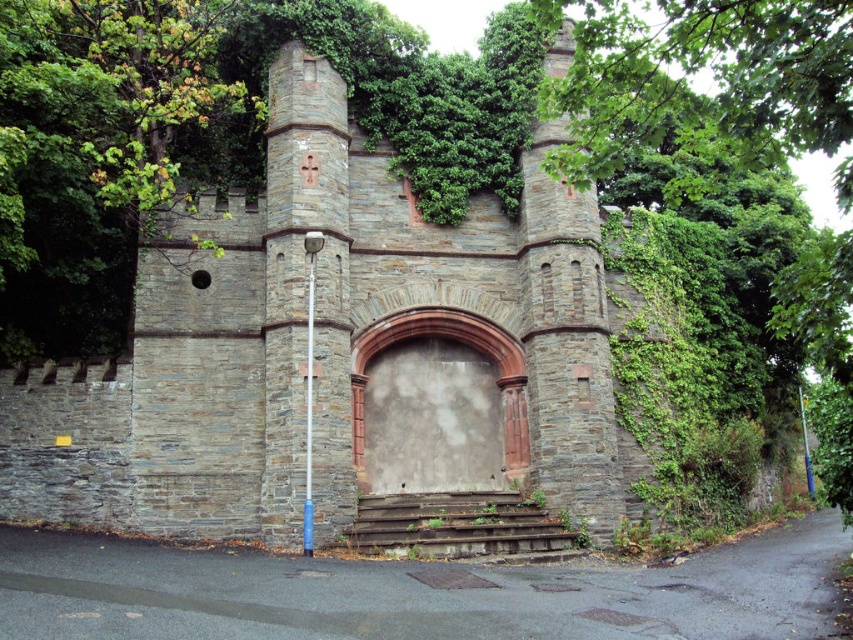
Question: Is stone wall gate at center smaller than blue plastic pole at center?

Choices:
 (A) yes
 (B) no

Answer: (B)

Question: Which object appears closest to the camera in this image?

Choices:
 (A) blue metallic pole at center
 (B) rusty metal stairs at center
 (C) stone wall gate at center

Answer: (C)

Question: Considering the relative positions of stone wall gate at center and rusty metal stairs at center in the image provided, where is stone wall gate at center located with respect to rusty metal stairs at center?

Choices:
 (A) right
 (B) left

Answer: (B)

Question: Which object is positioned closest to the stone wall gate at center?

Choices:
 (A) blue metallic pole at center
 (B) rusty metal stairs at center
 (C) blue plastic pole at center

Answer: (B)

Question: Which point appears closest to the camera in this image?

Choices:
 (A) (305, 552)
 (B) (329, 403)
 (C) (801, 428)

Answer: (A)

Question: Considering the relative positions of stone wall gate at center and blue plastic pole at center in the image provided, where is stone wall gate at center located with respect to blue plastic pole at center?

Choices:
 (A) below
 (B) above

Answer: (B)